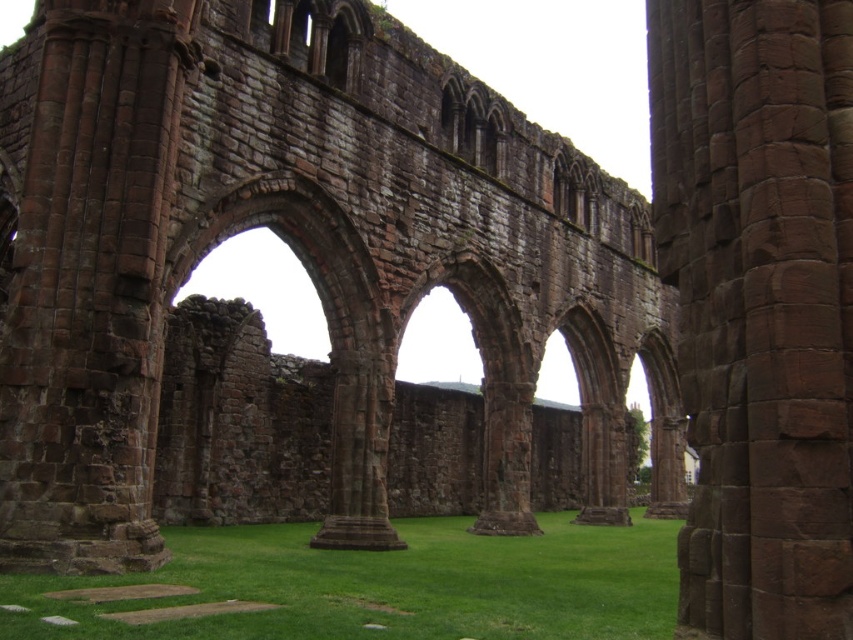
Locate an element on the screen. brown stone pillar at center is located at coordinates (759, 304).

Between brown stone pillar at center and brown stone arch at center, which one is positioned lower?

brown stone arch at center is lower down.

Which is behind, point (825, 595) or point (345, 314)?

Positioned behind is point (345, 314).

You are a GUI agent. You are given a task and a screenshot of the screen. Output one action in this format:
    pyautogui.click(x=<x>, y=<y>)
    Task: Click on the brown stone pillar at center
    
    Given the screenshot: What is the action you would take?
    pyautogui.click(x=759, y=304)

Is green grass at center wider than brown stone arch at center?

Indeed, green grass at center has a greater width compared to brown stone arch at center.

Which is behind, point (640, 614) or point (380, 410)?

Positioned behind is point (380, 410).

At what (x,y) coordinates should I click in order to perform the action: click on green grass at center. Please return your answer as a coordinate pair (x, y). The width and height of the screenshot is (853, 640). Looking at the image, I should click on (x=387, y=586).

You are a GUI agent. You are given a task and a screenshot of the screen. Output one action in this format:
    pyautogui.click(x=<x>, y=<y>)
    Task: Click on the green grass at center
    
    Given the screenshot: What is the action you would take?
    pyautogui.click(x=387, y=586)

Consider the image. How far apart are brown stone pillar at center and green grass at center?

22.51 meters

Which is in front, point (843, 500) or point (492, 586)?

Positioned in front is point (843, 500).

Find the location of a particular element. The height and width of the screenshot is (640, 853). brown stone pillar at center is located at coordinates coord(759,304).